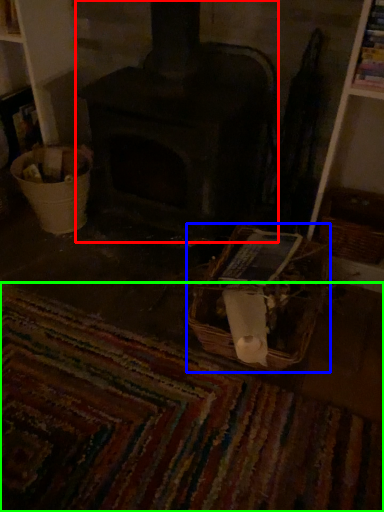
Question: Considering the real-world distances, which object is closest to wood burning stove (highlighted by a red box)? basket (highlighted by a blue box) or mat (highlighted by a green box).

Choices:
 (A) basket
 (B) mat

Answer: (A)